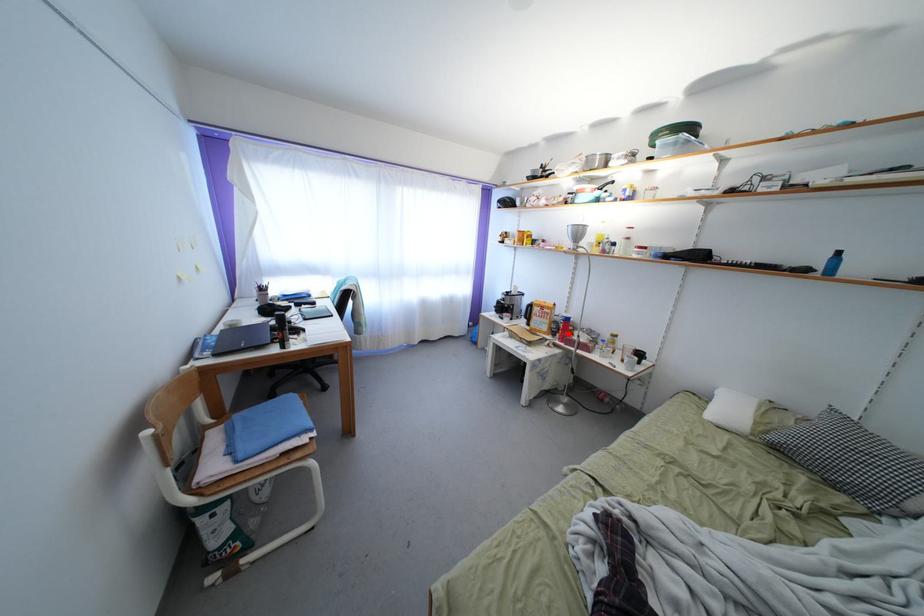
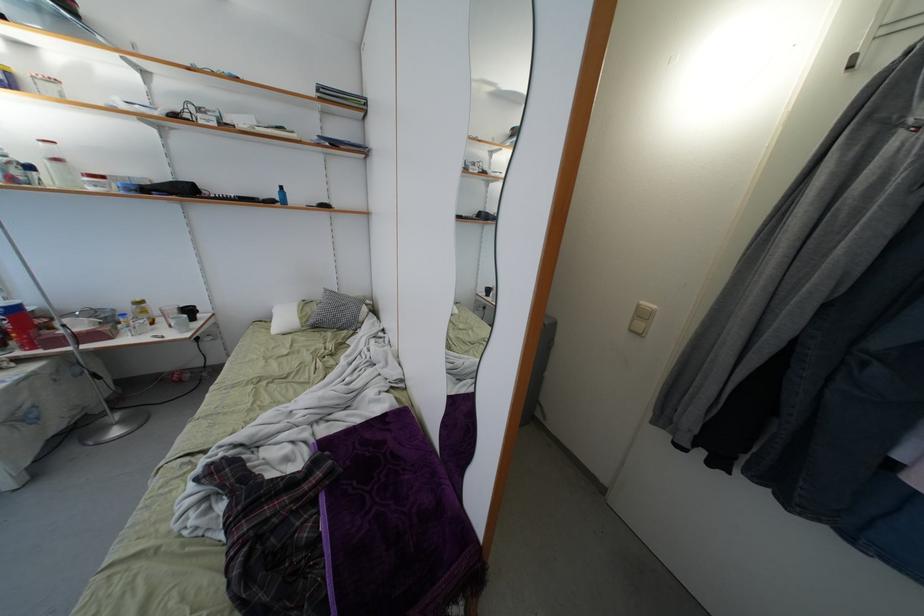
Where in the second image is the point corresponding to the highlighted location from the first image?

(22, 333)